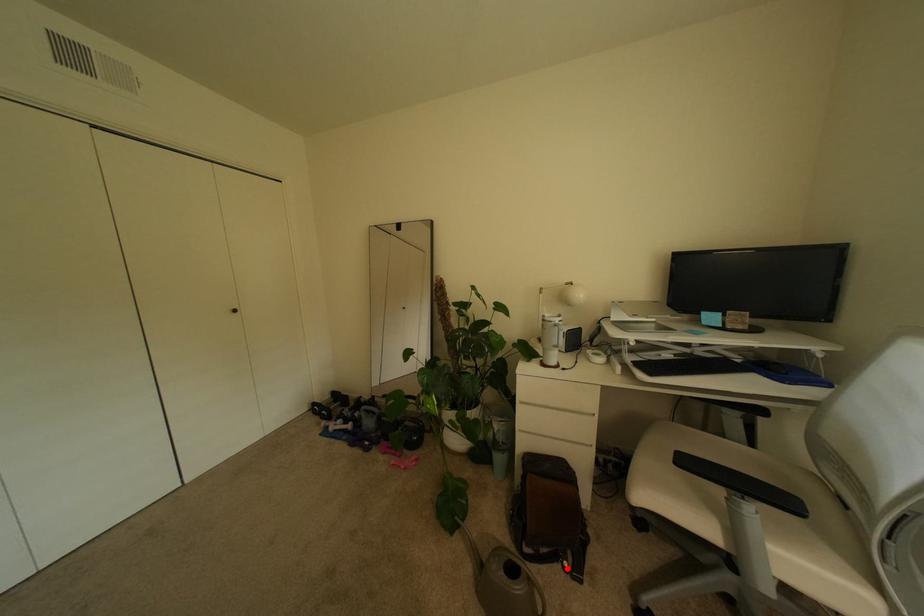
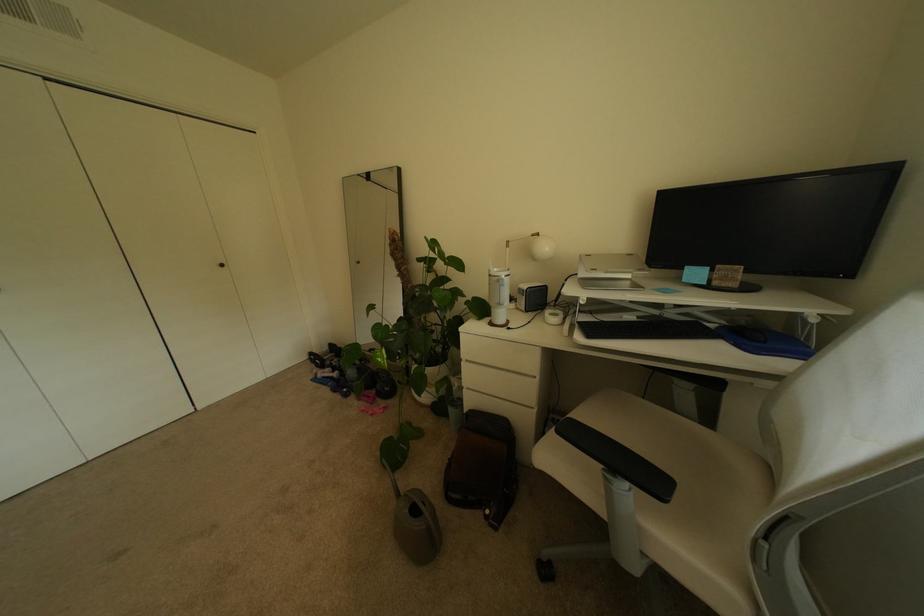
In the second image, find the point that corresponds to the highlighted location in the first image.

(488, 515)